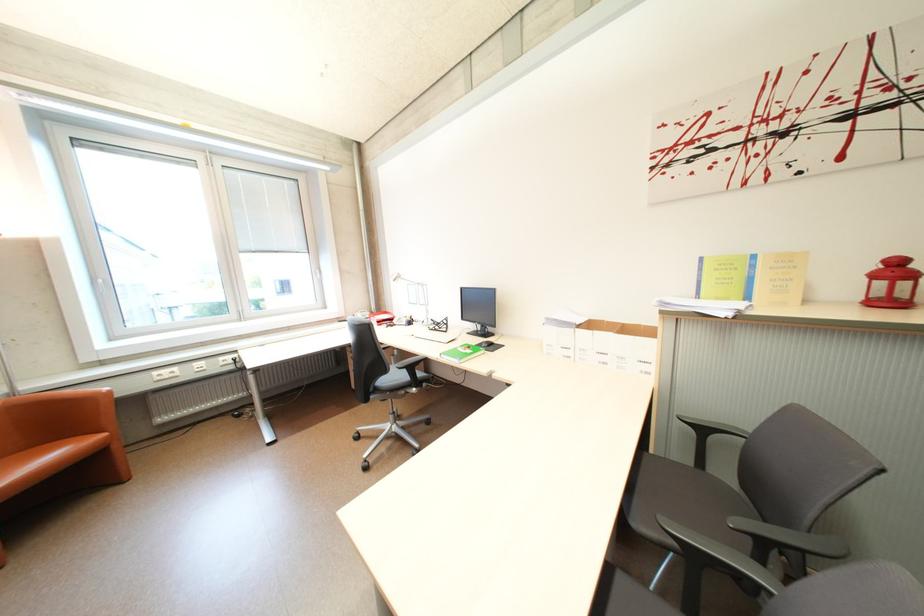
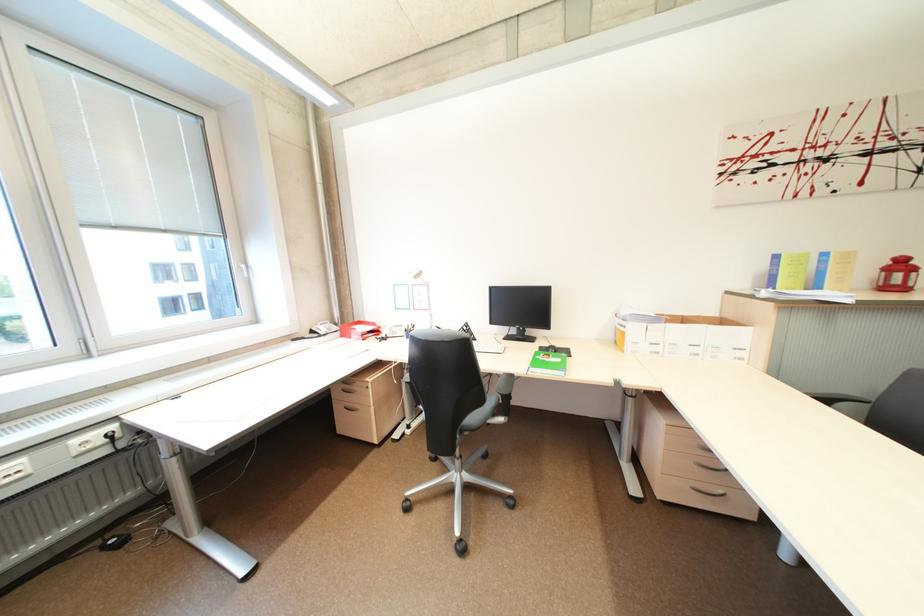
Locate, in the second image, the point that corresponds to the point at 393,383 in the first image.

(482, 419)